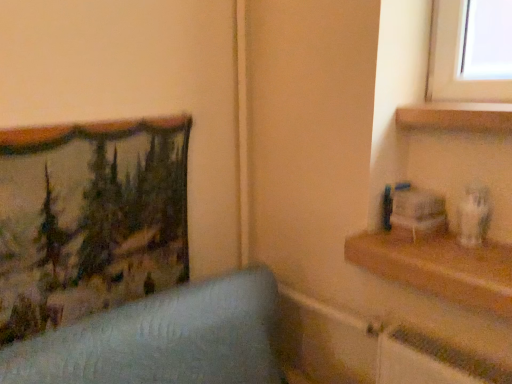
Question: From the image's perspective, does wooden shelf at right, which is the 1th shelf from bottom to top, appear lower than wooden shelf at upper right, the 2th shelf when ordered from bottom to top?

Choices:
 (A) yes
 (B) no

Answer: (A)

Question: Does wooden shelf at right, which is the 1th shelf from bottom to top, appear on the right side of wooden shelf at upper right, arranged as the first shelf when viewed from the top?

Choices:
 (A) no
 (B) yes

Answer: (A)

Question: From the image's perspective, is wooden shelf at right, the second shelf when ordered from top to bottom, on top of wooden shelf at upper right, arranged as the first shelf when viewed from the top?

Choices:
 (A) no
 (B) yes

Answer: (A)

Question: Can you confirm if wooden shelf at right, which is the 1th shelf from bottom to top, is bigger than wooden shelf at upper right, the 2th shelf when ordered from bottom to top?

Choices:
 (A) yes
 (B) no

Answer: (A)

Question: Is wooden shelf at right, the second shelf when ordered from top to bottom, shorter than wooden shelf at upper right, the 2th shelf when ordered from bottom to top?

Choices:
 (A) yes
 (B) no

Answer: (B)

Question: Considering the positions of wooden shelf at right, which is the 1th shelf from bottom to top, and textured fabric picture frame at left in the image, is wooden shelf at right, which is the 1th shelf from bottom to top, taller or shorter than textured fabric picture frame at left?

Choices:
 (A) short
 (B) tall

Answer: (A)

Question: From the image's perspective, is wooden shelf at right, which is the 1th shelf from bottom to top, above or below textured fabric picture frame at left?

Choices:
 (A) below
 (B) above

Answer: (A)

Question: From a real-world perspective, is wooden shelf at right, the second shelf when ordered from top to bottom, above or below textured fabric picture frame at left?

Choices:
 (A) above
 (B) below

Answer: (B)

Question: Is point (397, 273) positioned closer to the camera than point (31, 200)?

Choices:
 (A) farther
 (B) closer

Answer: (A)

Question: Considering the positions of textured fabric picture frame at left and wooden shelf at upper right, the 2th shelf when ordered from bottom to top, in the image, is textured fabric picture frame at left wider or thinner than wooden shelf at upper right, the 2th shelf when ordered from bottom to top,?

Choices:
 (A) thin
 (B) wide

Answer: (A)

Question: In the image, is textured fabric picture frame at left positioned in front of or behind wooden shelf at upper right, the 2th shelf when ordered from bottom to top?

Choices:
 (A) front
 (B) behind

Answer: (A)

Question: From the image's perspective, relative to wooden shelf at upper right, arranged as the first shelf when viewed from the top, is textured fabric picture frame at left above or below?

Choices:
 (A) above
 (B) below

Answer: (B)

Question: Does point 96,231 appear closer or farther from the camera than point 470,117?

Choices:
 (A) farther
 (B) closer

Answer: (A)

Question: Do you think wooden shelf at upper right, the 2th shelf when ordered from bottom to top, is within textured fabric picture frame at left, or outside of it?

Choices:
 (A) outside
 (B) inside

Answer: (A)

Question: In terms of size, does wooden shelf at upper right, arranged as the first shelf when viewed from the top, appear bigger or smaller than textured fabric picture frame at left?

Choices:
 (A) small
 (B) big

Answer: (A)